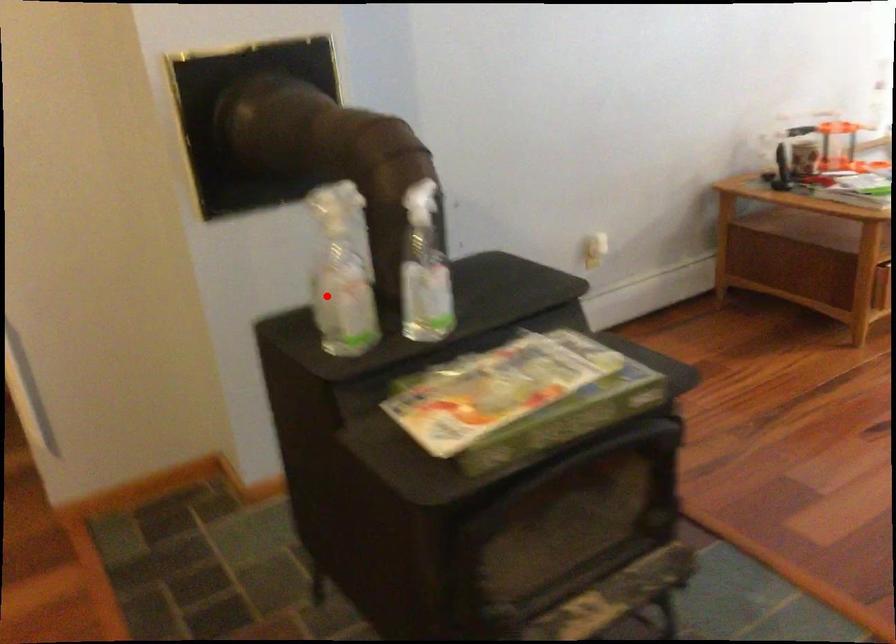
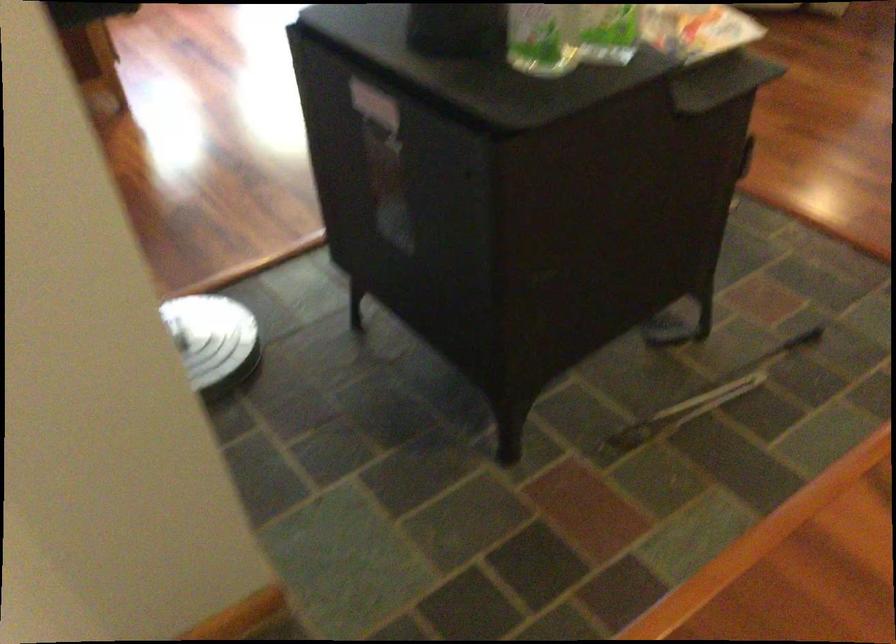
Question: I am providing you with two images of the same scene from different viewpoints. In image1, a red point is highlighted. Considering the same 3D point in image2, which of the following is correct?

Choices:
 (A) It is closer
 (B) It is farther

Answer: (A)